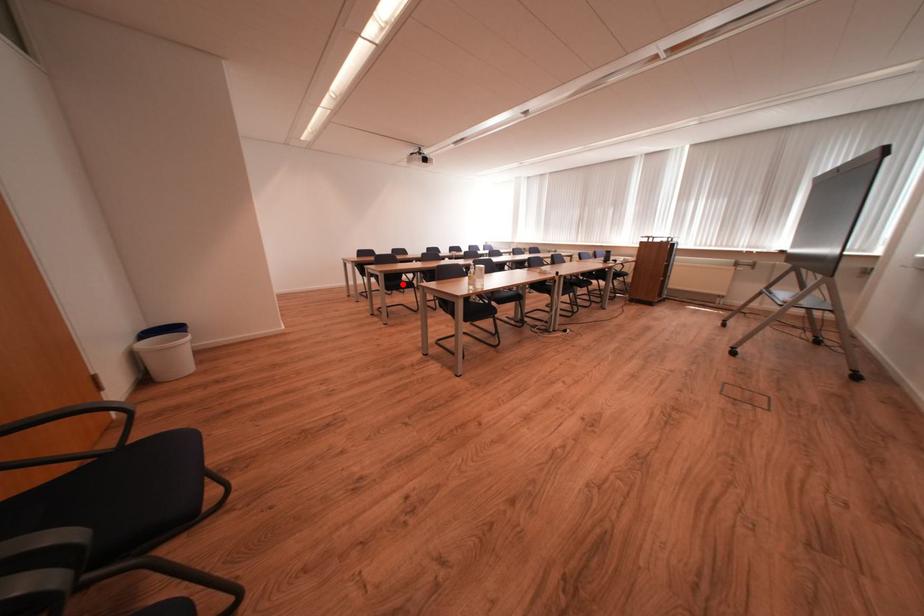
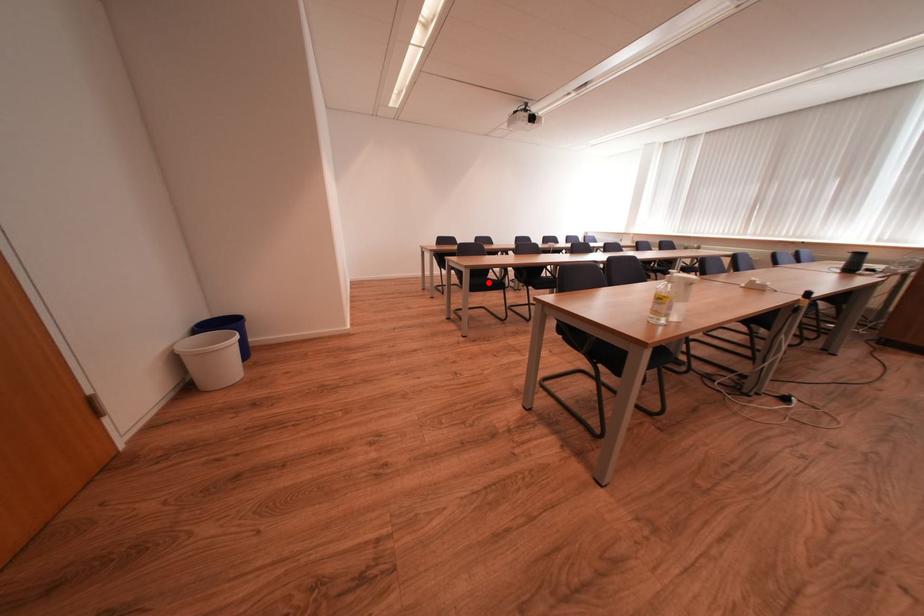
I am providing you with two images of the same scene from different viewpoints. A red point is marked on the first image and another point is marked on the second image. Is the marked point in image1 the same physical position as the marked point in image2?

Yes